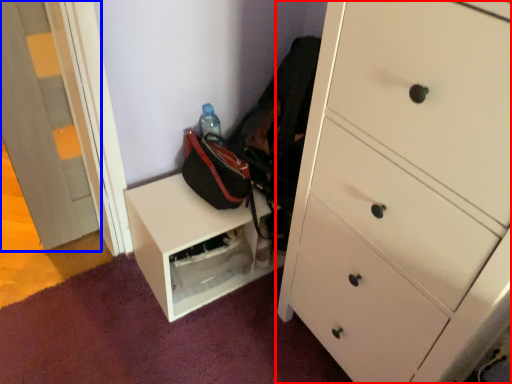
Question: Which of the following is the closest to the observer, chest of drawers (highlighted by a red box) or door (highlighted by a blue box)?

Choices:
 (A) chest of drawers
 (B) door

Answer: (A)